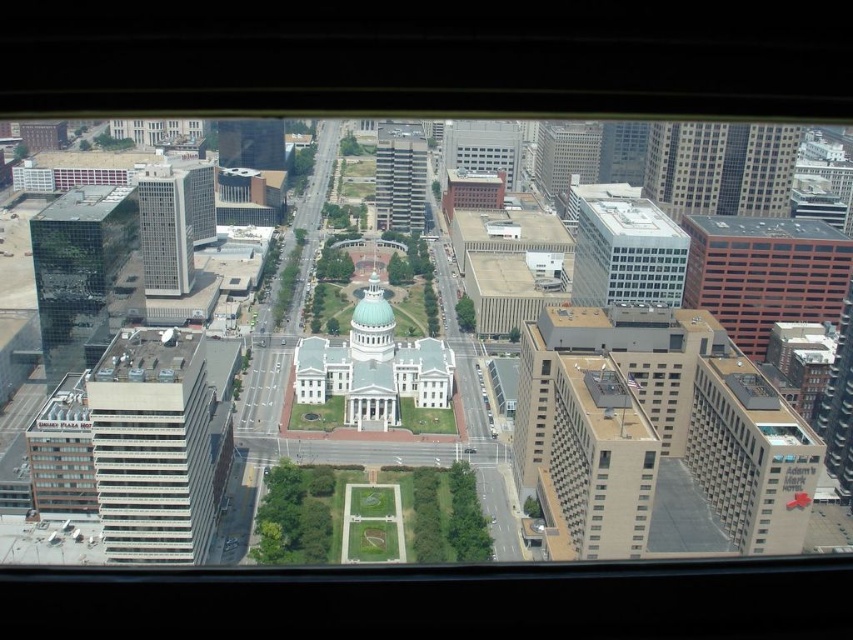
The width and height of the screenshot is (853, 640). Describe the element at coordinates (720, 168) in the screenshot. I see `glassy reflective skyscraper at upper right` at that location.

At what (x,y) coordinates should I click in order to perform the action: click on glassy reflective skyscraper at upper right. Please return your answer as a coordinate pair (x, y). This screenshot has width=853, height=640. Looking at the image, I should click on (720, 168).

Can you confirm if glassy reflective skyscraper at upper right is wider than gray concrete skyscraper at center?

Yes, glassy reflective skyscraper at upper right is wider than gray concrete skyscraper at center.

Is glassy reflective skyscraper at upper right closer to camera compared to gray concrete skyscraper at center?

Yes.

Describe the element at coordinates (720, 168) in the screenshot. The width and height of the screenshot is (853, 640). I see `glassy reflective skyscraper at upper right` at that location.

This screenshot has height=640, width=853. Identify the location of glassy reflective skyscraper at upper right. (720, 168).

Which is below, white glass building at upper right or glassy reflective skyscraper at left?

white glass building at upper right

Can you confirm if white glass building at upper right is taller than glassy reflective skyscraper at left?

No.

Does point (672, 268) come closer to viewer compared to point (180, 188)?

Yes, it is in front of point (180, 188).

Locate an element on the screen. The image size is (853, 640). white glass building at upper right is located at coordinates (627, 253).